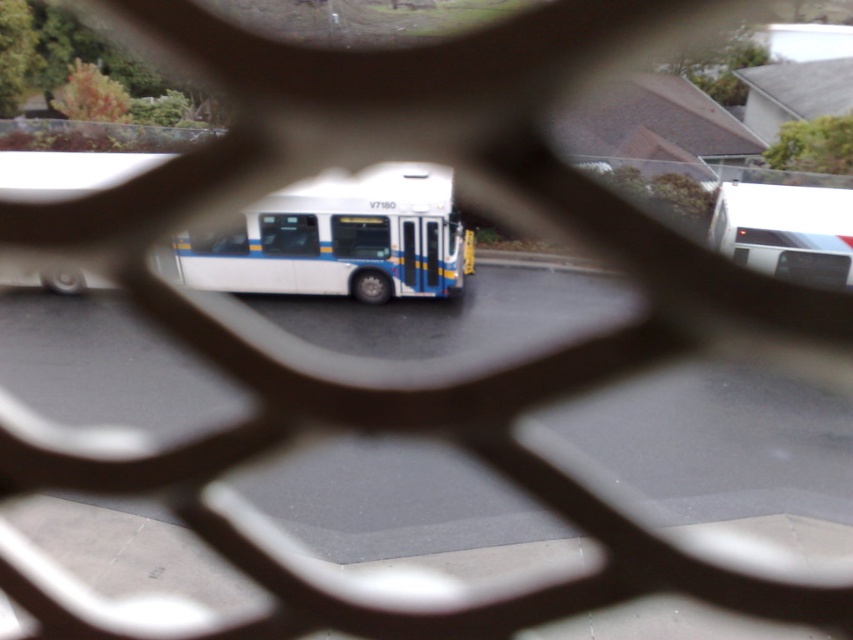
Does white matte bus at center have a greater width compared to white glossy bus at center?

In fact, white matte bus at center might be narrower than white glossy bus at center.

Is white matte bus at center shorter than white glossy bus at center?

Correct, white matte bus at center is not as tall as white glossy bus at center.

Locate an element on the screen. Image resolution: width=853 pixels, height=640 pixels. white matte bus at center is located at coordinates (334, 240).

Find the location of a particular element. The height and width of the screenshot is (640, 853). white matte bus at center is located at coordinates (334, 240).